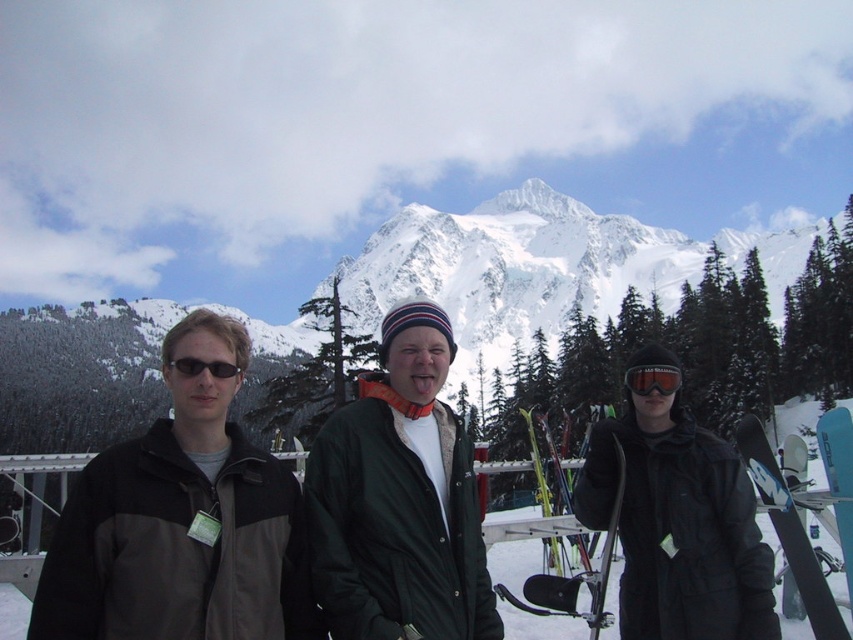
You are navigating a drone through the snowy mountain area shown in the image. There are two points marked as point 1 and point 2. Point 1 is at coordinates point [413,237] and point 2 is at coordinates point [252,516]. Your drone needs to fly from point 1 to point 2. Considering the spatial relationship between these two points, which direction should the drone primarily move in to reach point 2 from point 1?

The drone should primarily move downward and to the right to reach point 2 from point 1 since point 1 is behind point 2, meaning it is positioned higher up and to the left in the image.

You are planning to take a photo of the dark gray jacket at center and the snowy mountain at center. Which object will appear smaller in the photo?

The dark gray jacket at center will appear smaller in the photo because it occupies less space than the snowy mountain at center.

You are planning to place a small weather station at point [515,266] in the snowy mountain at center. Based on the scene description, what terrain feature would this location most likely be on?

The point [515,266] is on the snowy mountain at center, so it is likely located on a mountain slope covered in snow.